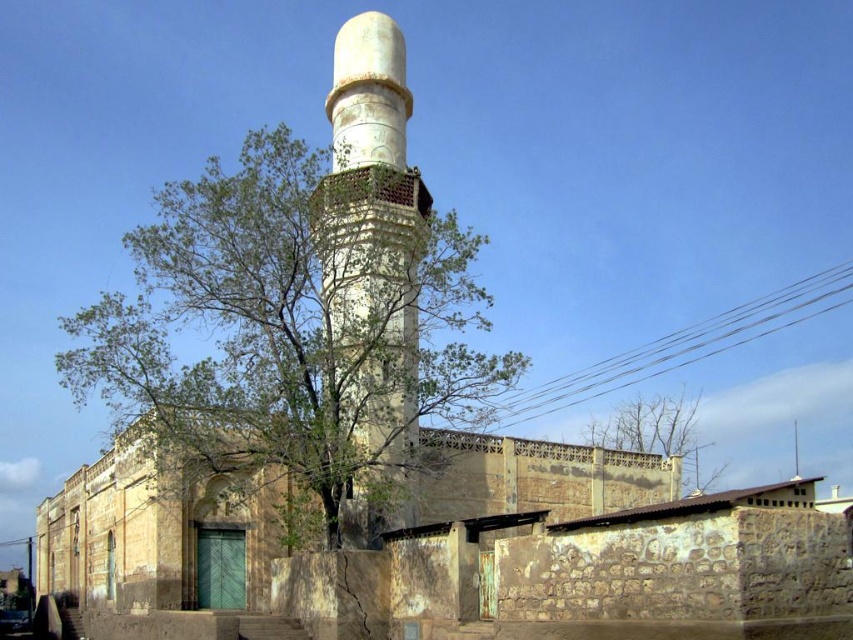
Which is more to the left, white stone minaret at center or bare branches at upper center?

white stone minaret at center

How far apart are white stone minaret at center and bare branches at upper center?

white stone minaret at center and bare branches at upper center are 61.06 meters apart from each other.

Locate an element on the screen. white stone minaret at center is located at coordinates (372, 150).

Is point (352, 336) closer to camera compared to point (381, 436)?

Yes.

Consider the image. Who is more distant from viewer, (144, 289) or (360, 536)?

Positioned behind is point (144, 289).

Image resolution: width=853 pixels, height=640 pixels. Identify the location of green leafy tree at center. (291, 323).

Is point (469, 349) positioned before point (618, 420)?

No, (469, 349) is further to viewer.

Describe the element at coordinates (291, 323) in the screenshot. I see `green leafy tree at center` at that location.

This screenshot has width=853, height=640. I want to click on green leafy tree at center, so click(291, 323).